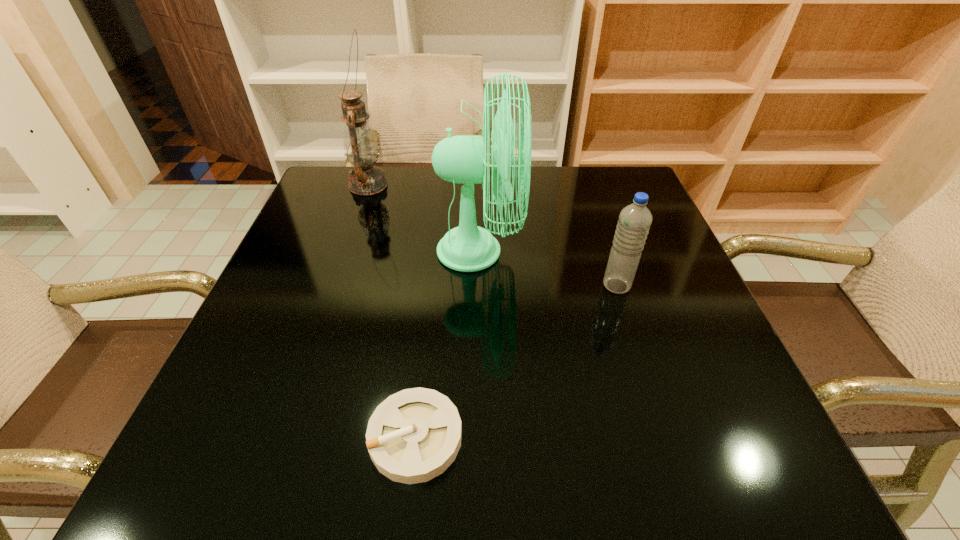
The image size is (960, 540). I want to click on blank area in the image that satisfies the following two spatial constraints: 1. in front of the fan to blow air; 2. on the back side of the third tallest object, so click(x=478, y=286).

This screenshot has width=960, height=540. I want to click on vacant space that satisfies the following two spatial constraints: 1. in front of the fan to blow air; 2. on the right side of the water bottle, so click(x=478, y=286).

This screenshot has height=540, width=960. Find the location of `vacant region that satisfies the following two spatial constraints: 1. in front of the rightmost object to blow air; 2. on the left side of the fan`. vacant region that satisfies the following two spatial constraints: 1. in front of the rightmost object to blow air; 2. on the left side of the fan is located at coordinates (478, 286).

Identify the location of free point that satisfies the following two spatial constraints: 1. in front of the fan to blow air; 2. on the back side of the second shortest object. (478, 286).